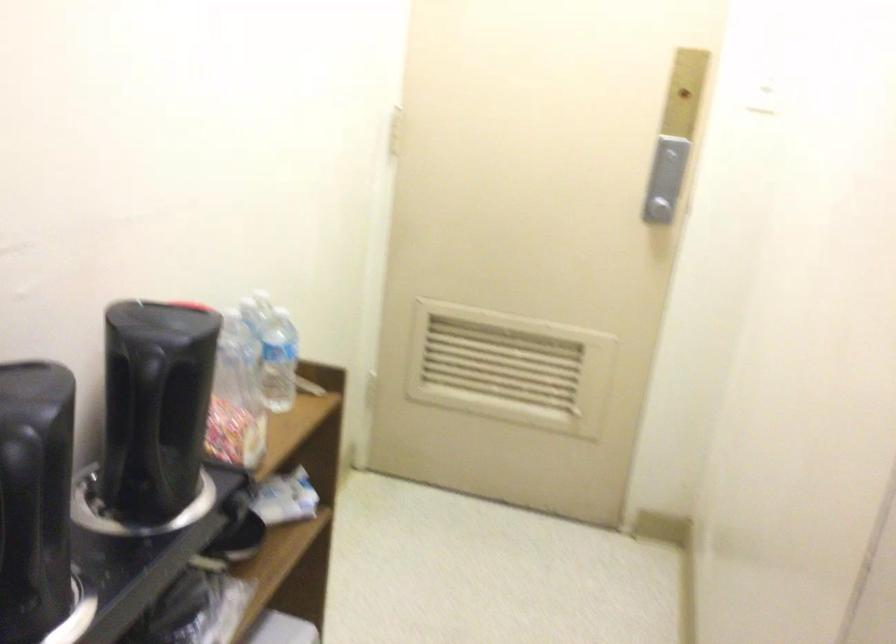
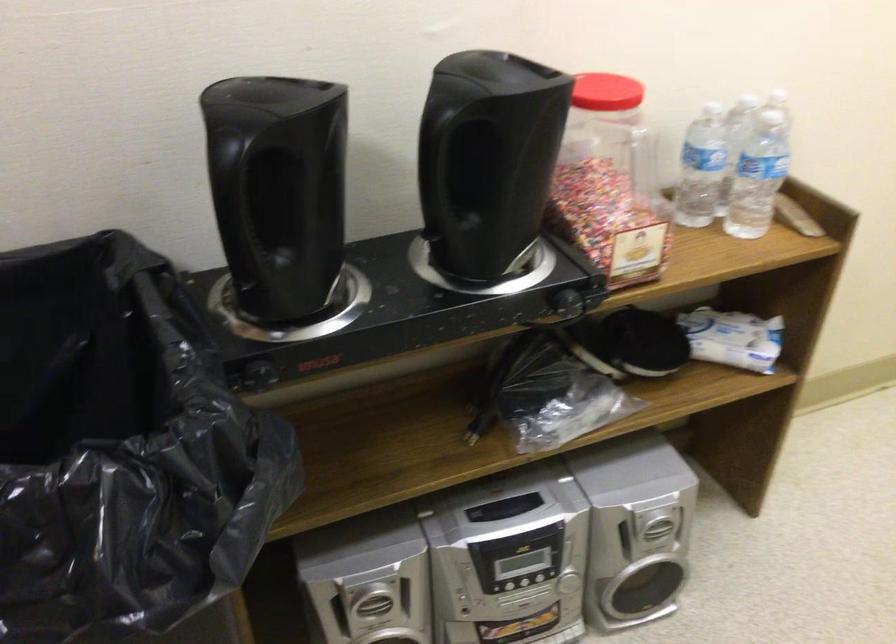
Find the pixel in the second image that matches point (243, 370) in the first image.

(701, 167)